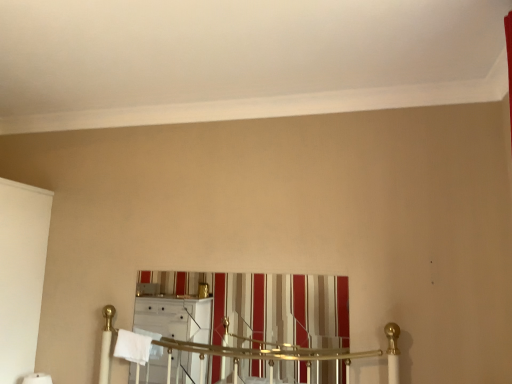
Question: Does white soft bath towel at center appear on the right side of striped fabric curtain at center?

Choices:
 (A) no
 (B) yes

Answer: (A)

Question: Is white soft bath towel at center to the left of striped fabric curtain at center from the viewer's perspective?

Choices:
 (A) no
 (B) yes

Answer: (B)

Question: Is white soft bath towel at center not inside striped fabric curtain at center?

Choices:
 (A) no
 (B) yes

Answer: (B)

Question: Is the position of white soft bath towel at center more distant than that of striped fabric curtain at center?

Choices:
 (A) no
 (B) yes

Answer: (B)

Question: Is striped fabric curtain at center located within white soft bath towel at center?

Choices:
 (A) no
 (B) yes

Answer: (A)

Question: Considering the relative sizes of white soft bath towel at center and striped fabric curtain at center in the image provided, is white soft bath towel at center thinner than striped fabric curtain at center?

Choices:
 (A) no
 (B) yes

Answer: (A)

Question: Is striped fabric curtain at center bigger than white soft bath towel at center?

Choices:
 (A) yes
 (B) no

Answer: (A)

Question: Does striped fabric curtain at center come behind white soft bath towel at center?

Choices:
 (A) no
 (B) yes

Answer: (A)

Question: Can you confirm if striped fabric curtain at center is shorter than white soft bath towel at center?

Choices:
 (A) yes
 (B) no

Answer: (B)

Question: Are striped fabric curtain at center and white soft bath towel at center far apart?

Choices:
 (A) yes
 (B) no

Answer: (B)

Question: Is striped fabric curtain at center beside white soft bath towel at center?

Choices:
 (A) yes
 (B) no

Answer: (B)

Question: Does striped fabric curtain at center come in front of white soft bath towel at center?

Choices:
 (A) no
 (B) yes

Answer: (B)

Question: Considering the positions of white soft bath towel at center and striped fabric curtain at center in the image, is white soft bath towel at center wider or thinner than striped fabric curtain at center?

Choices:
 (A) thin
 (B) wide

Answer: (B)